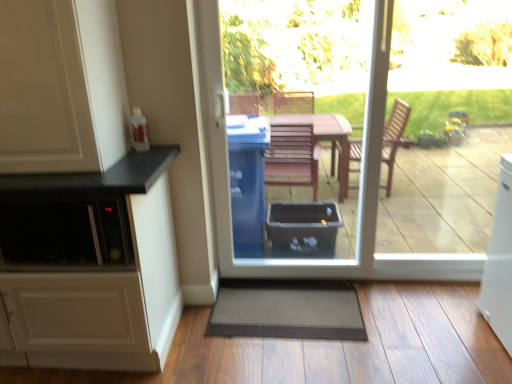
The image size is (512, 384). What are the coordinates of `free area in between white matte cabinet at left, which appears as the 2th cabinetry when viewed from the top, and gray textured mat at lower center` in the screenshot? It's located at click(x=229, y=350).